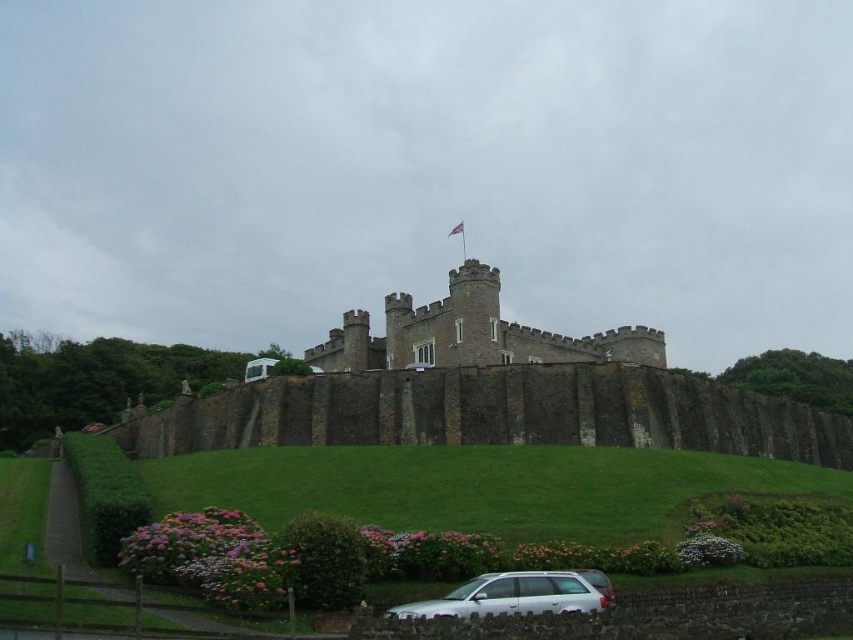
Question: Which point appears farthest from the camera in this image?

Choices:
 (A) (489, 275)
 (B) (511, 609)

Answer: (A)

Question: Is smooth stone castle at center below white matte station wagon at lower center?

Choices:
 (A) no
 (B) yes

Answer: (A)

Question: Is smooth stone castle at center wider than white matte station wagon at lower center?

Choices:
 (A) yes
 (B) no

Answer: (A)

Question: Observing the image, what is the correct spatial positioning of smooth stone castle at center in reference to white matte station wagon at lower center?

Choices:
 (A) right
 (B) left

Answer: (A)